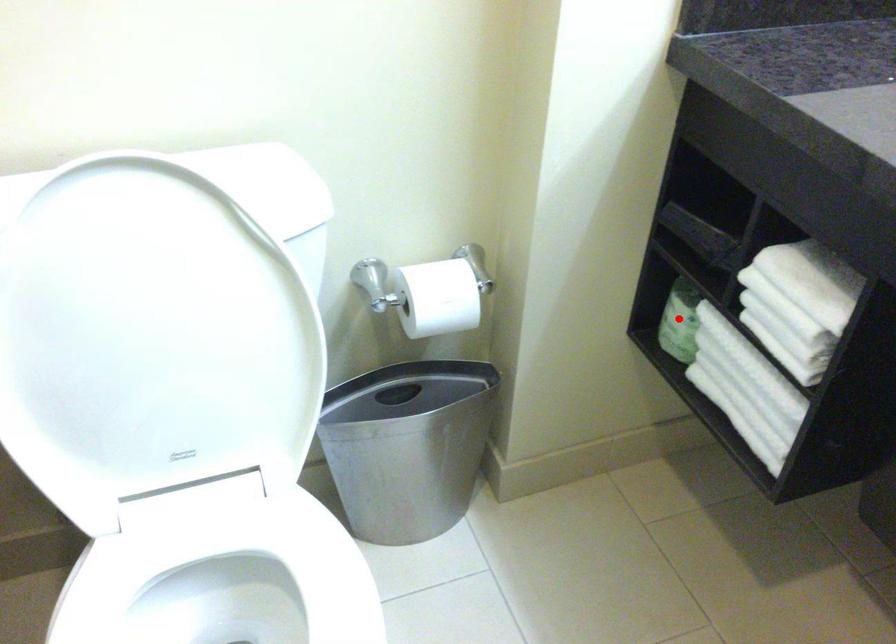
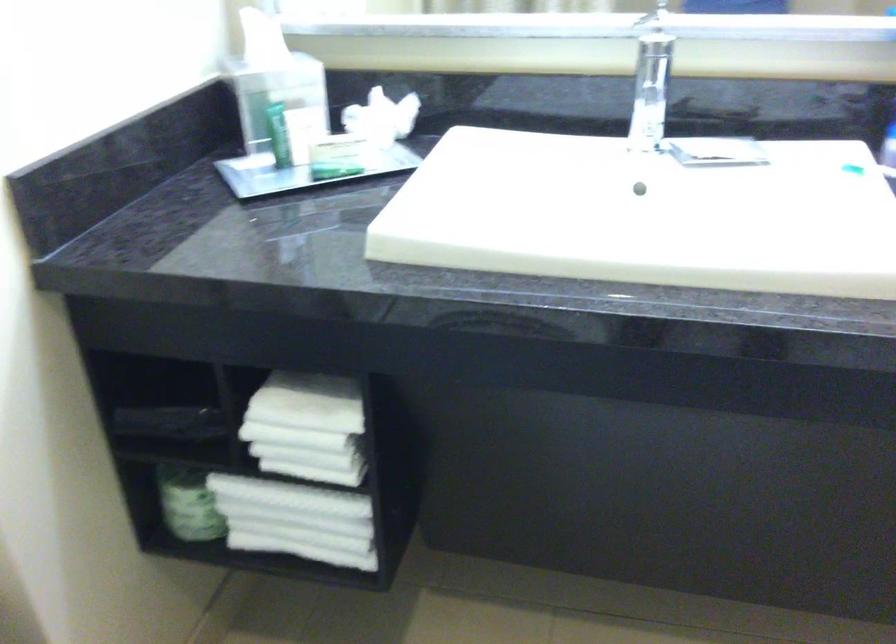
Where in the second image is the point corresponding to the highlighted location from the first image?

(188, 504)